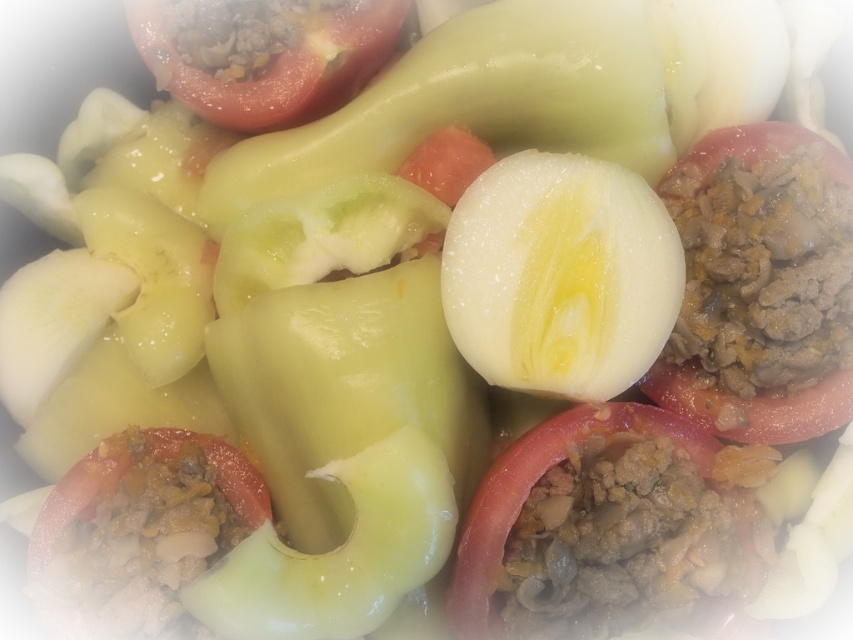
You are a food critic who needs to describe the location of the meaty tomato at center in the dish. What are its coordinates?

The meaty tomato at center is located at coordinates point (608, 528).

You are a food critic standing 34.84 inches away from the meaty tomato at center. Can you comfortably reach out and touch it without moving your hand too far?

The distance between you and the meaty tomato at center is 34.84 inches, which is about 3 feet. Since this distance is within an average person reach, you can comfortably touch it without moving your hand too far.

You are a food critic inspecting this dish of stuffed vegetables and eggs. You notice two points marked on the image. Which point is closer to you, point (663, 314) or point (287, 72)?

Point (663, 314) is closer to the viewer than point (287, 72).